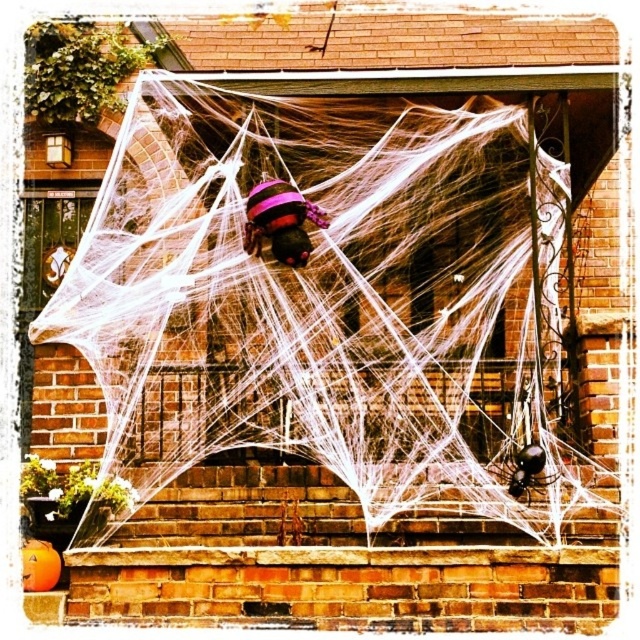
Question: Which of the following is the farthest from the observer?

Choices:
 (A) (314, 216)
 (B) (380, 145)

Answer: (B)

Question: Can you confirm if purple fuzzy spider at center is bigger than black glossy spider at lower right?

Choices:
 (A) no
 (B) yes

Answer: (B)

Question: Which point is closer to the camera?

Choices:
 (A) black glossy spider at lower right
 (B) purple fuzzy spider at center

Answer: (A)

Question: Which point appears farthest from the camera in this image?

Choices:
 (A) (289, 221)
 (B) (531, 467)

Answer: (A)

Question: Is white mesh spider web at center bigger than black glossy spider at lower right?

Choices:
 (A) yes
 (B) no

Answer: (A)

Question: Does purple fuzzy spider at center appear over black glossy spider at lower right?

Choices:
 (A) no
 (B) yes

Answer: (B)